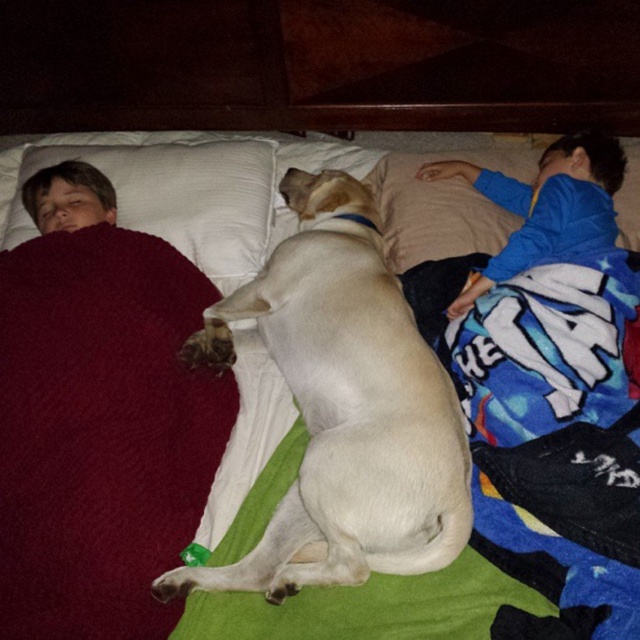
Question: Is white smooth dog at center further to the viewer compared to blue fleece blanket at right?

Choices:
 (A) yes
 (B) no

Answer: (B)

Question: Can you confirm if white smooth dog at center is positioned to the left of blue fleece blanket at right?

Choices:
 (A) yes
 (B) no

Answer: (A)

Question: Which object is closer to the camera taking this photo?

Choices:
 (A) white smooth dog at center
 (B) blue fleece blanket at right

Answer: (A)

Question: Is white smooth dog at center further to camera compared to blue fleece blanket at right?

Choices:
 (A) yes
 (B) no

Answer: (B)

Question: Considering the real-world distances, which object is closest to the white smooth dog at center?

Choices:
 (A) blue fleece blanket at right
 (B) white soft pillow at upper left

Answer: (B)

Question: Based on their relative distances, which object is farther from the white soft pillow at upper left?

Choices:
 (A) blue fleece blanket at right
 (B) white smooth dog at center

Answer: (A)